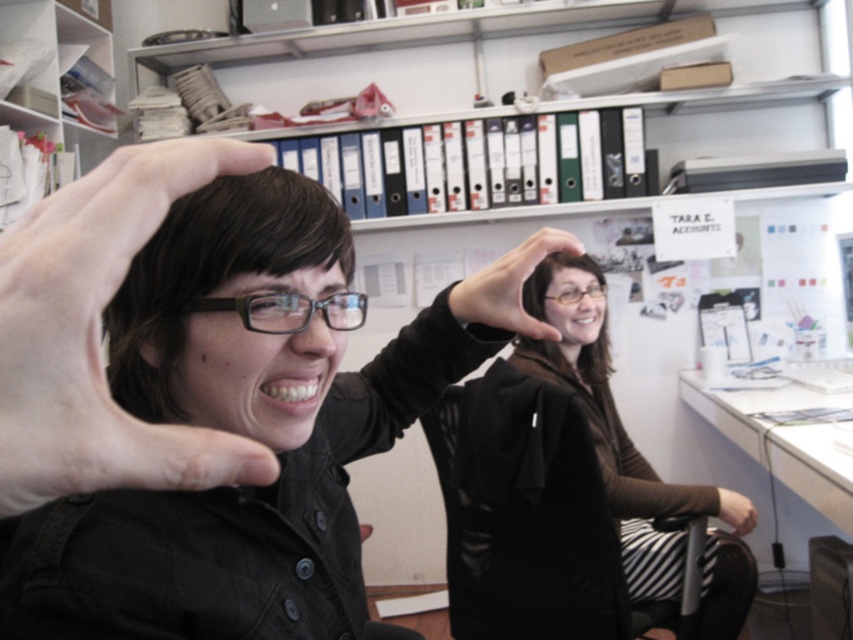
Is matte black glasses at center positioned before clear plastic glasses at center?

Yes.

How distant is matte black glasses at center from clear plastic glasses at center?

They are 1.21 meters apart.

Where is `matte black glasses at center`? This screenshot has height=640, width=853. matte black glasses at center is located at coordinates (287, 310).

Which is in front, point (525, 339) or point (563, 301)?

Point (525, 339) is in front.

Where is `brownsmoothhair at center`? This screenshot has height=640, width=853. brownsmoothhair at center is located at coordinates (550, 276).

Is point (548, 278) behind point (573, 301)?

No.

What are the coordinates of `brownsmoothhair at center` in the screenshot? It's located at (550, 276).

Can you confirm if brownsmoothhair at center is positioned to the left of matte black hand at lower right?

Indeed, brownsmoothhair at center is positioned on the left side of matte black hand at lower right.

Is brownsmoothhair at center wider than matte black hand at lower right?

Correct, the width of brownsmoothhair at center exceeds that of matte black hand at lower right.

Where is `brownsmoothhair at center`? Image resolution: width=853 pixels, height=640 pixels. brownsmoothhair at center is located at coordinates (550, 276).

Locate an element on the screen. brownsmoothhair at center is located at coordinates (550, 276).